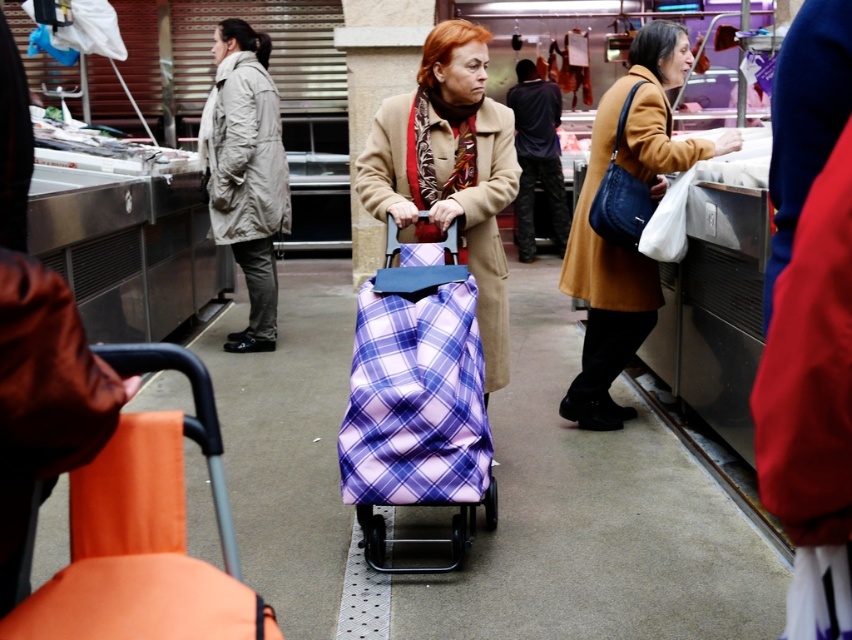
Who is higher up, plaid fabric bag at center or brown wool coat at center?

brown wool coat at center is higher up.

Is plaid fabric bag at center bigger than brown wool coat at center?

No.

Which is behind, point (410, 310) or point (640, 144)?

Point (640, 144)

You are a GUI agent. You are given a task and a screenshot of the screen. Output one action in this format:
    pyautogui.click(x=<x>, y=<y>)
    Task: Click on the plaid fabric bag at center
    Image resolution: width=852 pixels, height=640 pixels.
    Given the screenshot: What is the action you would take?
    pyautogui.click(x=415, y=384)

Is plaid fabric bag at center thinner than matte blue leather bag at right?

No.

Can you confirm if plaid fabric bag at center is bigger than matte blue leather bag at right?

Yes, plaid fabric bag at center is bigger than matte blue leather bag at right.

Describe the element at coordinates (415, 384) in the screenshot. The image size is (852, 640). I see `plaid fabric bag at center` at that location.

You are a GUI agent. You are given a task and a screenshot of the screen. Output one action in this format:
    pyautogui.click(x=<x>, y=<y>)
    Task: Click on the plaid fabric bag at center
    This screenshot has height=640, width=852.
    Given the screenshot: What is the action you would take?
    pyautogui.click(x=415, y=384)

Can you confirm if light beige coat at left is wider than matte blue leather bag at right?

Yes, light beige coat at left is wider than matte blue leather bag at right.

Which is in front, point (214, 145) or point (640, 192)?

Positioned in front is point (640, 192).

What do you see at coordinates (246, 172) in the screenshot? Image resolution: width=852 pixels, height=640 pixels. I see `light beige coat at left` at bounding box center [246, 172].

Where is `light beige coat at left`? Image resolution: width=852 pixels, height=640 pixels. light beige coat at left is located at coordinates (246, 172).